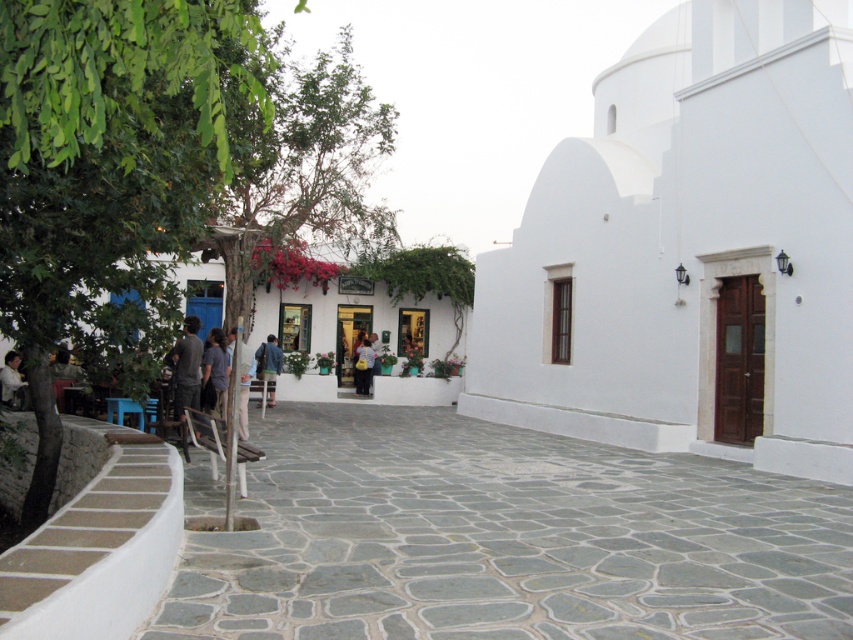
Based on the photo, you are a photographer standing in the Mediterranean street scene. You notice a person wearing a dark gray shirt at center and blue denim jeans at center. Based on their clothing, can you determine if the shirt is positioned higher up on the body compared to the jeans?

The dark gray shirt at center is located above the blue denim jeans at center, so yes, the shirt is positioned higher up on the body compared to the jeans.

Looking at this image, you are a fashion designer observing a model wearing both a dark gray shirt at center and a dark gray fabric jacket at center. Which piece of clothing is positioned higher on the model?

The dark gray shirt at center is located above the dark gray fabric jacket at center, so the shirt is positioned higher on the model.

You are a photographer standing in the middle of the cobblestone pathway. You want to take a photo of the dark gray shirt at center and blue denim jeans at center. Which clothing item appears narrower in the photo?

The dark gray shirt at center appears narrower than the blue denim jeans at center in the photo.